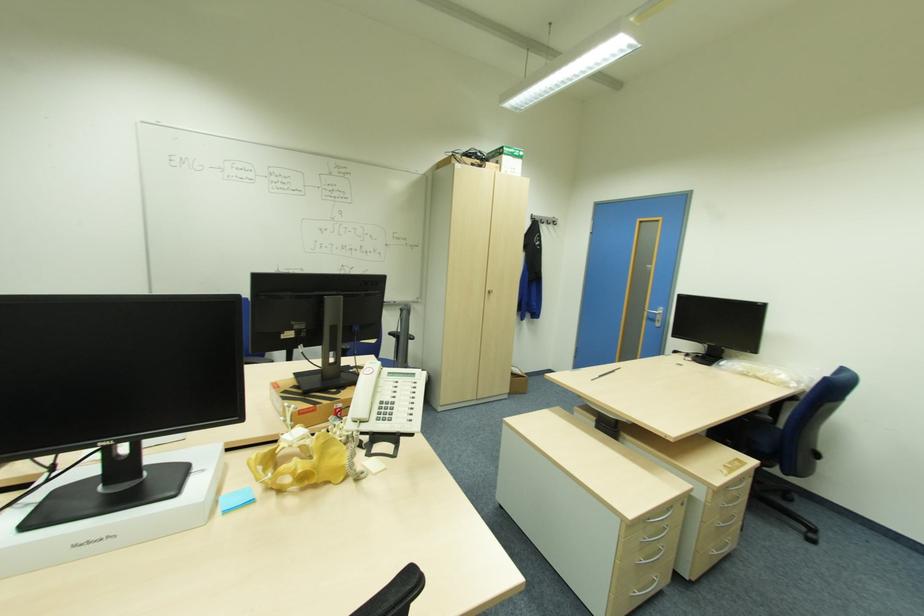
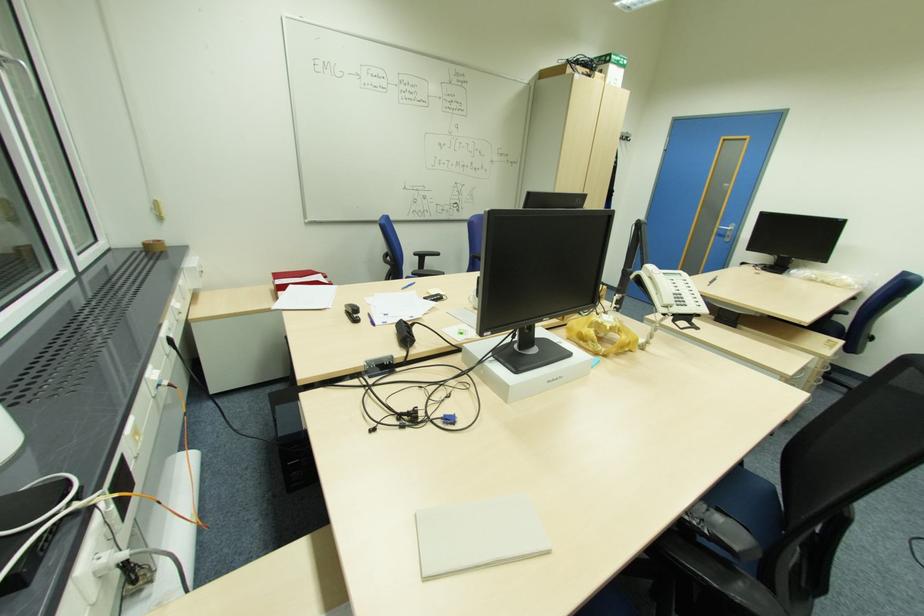
Locate, in the second image, the point that corresponds to the point at 92,541 in the first image.

(555, 379)